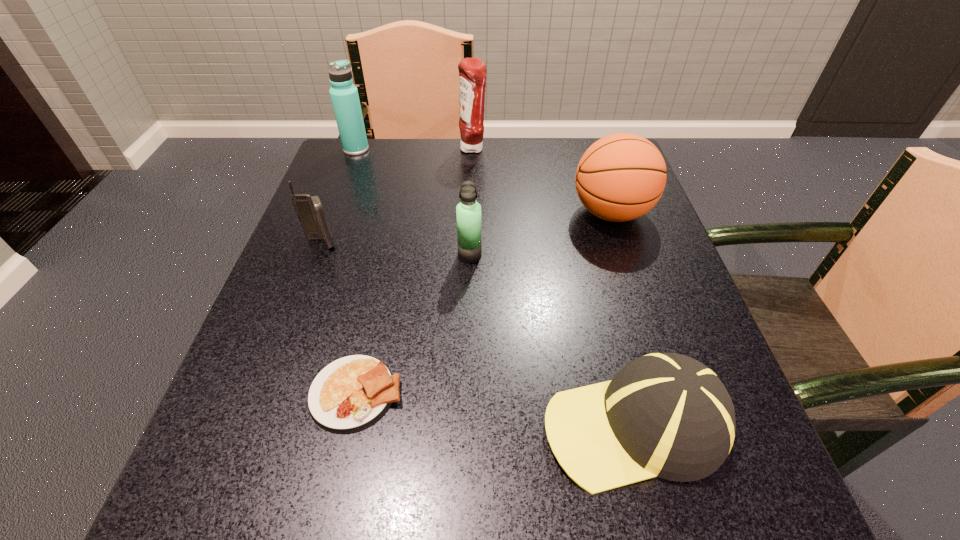
Image resolution: width=960 pixels, height=540 pixels. Find the location of `vacant area situated 0.390m on the front of the condiment`. vacant area situated 0.390m on the front of the condiment is located at coordinates pyautogui.click(x=470, y=264).

Where is `vacant space situated on the right of the taller thermos bottle`? The width and height of the screenshot is (960, 540). vacant space situated on the right of the taller thermos bottle is located at coordinates (425, 149).

Where is `vacant space situated 0.140m on the back of the basketball`? vacant space situated 0.140m on the back of the basketball is located at coordinates (592, 158).

Where is `free space located on the back of the right thermos bottle`? free space located on the back of the right thermos bottle is located at coordinates (472, 156).

At what (x,y) coordinates should I click in order to perform the action: click on vacant region located on the keyboard of the fifth tallest object. Please return your answer as a coordinate pair (x, y). The width and height of the screenshot is (960, 540). Looking at the image, I should click on (262, 400).

The width and height of the screenshot is (960, 540). Find the location of `free space located 0.350m with the brim of the sixth tallest object facing forward`. free space located 0.350m with the brim of the sixth tallest object facing forward is located at coordinates (300, 425).

This screenshot has width=960, height=540. In order to click on vacant space located with the brim of the sixth tallest object facing forward in this screenshot , I will do `click(327, 425)`.

Where is `vacant area situated with the brim of the sixth tallest object facing forward`? The width and height of the screenshot is (960, 540). vacant area situated with the brim of the sixth tallest object facing forward is located at coordinates (334, 425).

This screenshot has height=540, width=960. Find the location of `vacant space located on the right of the shortest object`. vacant space located on the right of the shortest object is located at coordinates (660, 393).

This screenshot has height=540, width=960. I want to click on condiment at the far edge, so click(472, 71).